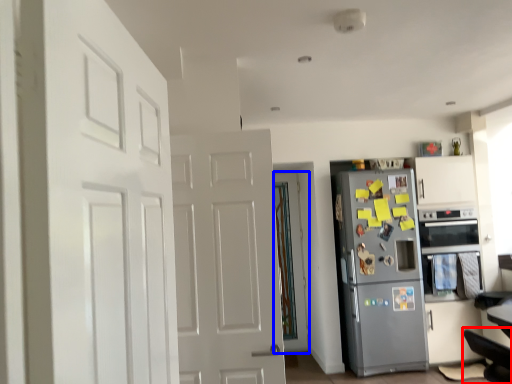
Question: Which object appears closest to the camera in this image, swivel chair (highlighted by a red box) or door (highlighted by a blue box)?

Choices:
 (A) swivel chair
 (B) door

Answer: (A)